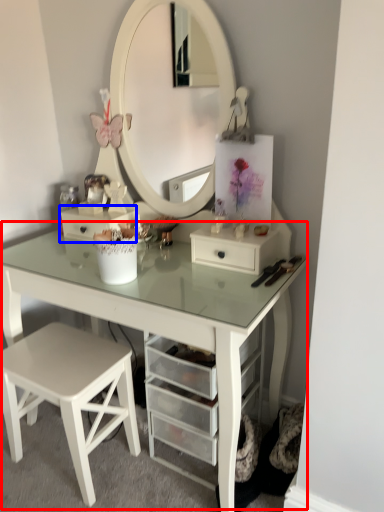
Question: Which object is closer to the camera taking this photo, table (highlighted by a red box) or drawer (highlighted by a blue box)?

Choices:
 (A) table
 (B) drawer

Answer: (A)